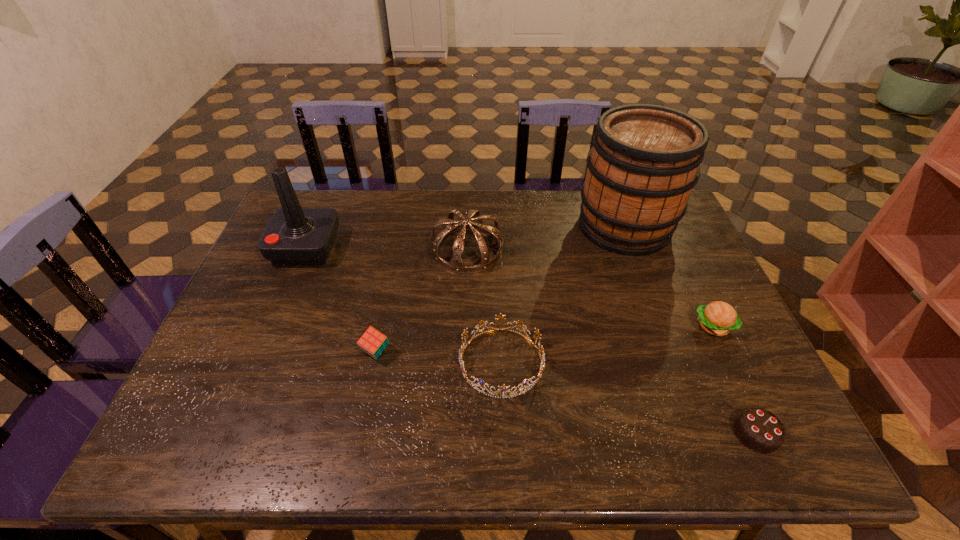
The width and height of the screenshot is (960, 540). Find the location of `free region located on the front of the sixth shortest object`. free region located on the front of the sixth shortest object is located at coordinates (268, 338).

Where is `vacant area situated 0.090m on the left of the taller tiara`? vacant area situated 0.090m on the left of the taller tiara is located at coordinates (402, 250).

Where is `vacant region located on the back of the hamburger`? The width and height of the screenshot is (960, 540). vacant region located on the back of the hamburger is located at coordinates pyautogui.click(x=667, y=228).

Find the location of a particular element. The image size is (960, 540). free region located on the left of the cube is located at coordinates (328, 352).

I want to click on free space located 0.110m on the front-facing side of the nearer tiara, so click(505, 450).

Identify the location of free spot located on the left of the chocolate cake. (655, 434).

In order to click on cider located at the far edge in this screenshot , I will do `click(644, 162)`.

You are a GUI agent. You are given a task and a screenshot of the screen. Output one action in this format:
    pyautogui.click(x=<x>, y=<y>)
    Task: Click on the joystick situated at the far edge
    The image size is (960, 540).
    Given the screenshot: What is the action you would take?
    pyautogui.click(x=294, y=236)

Where is `tiara that is at the far edge`? Image resolution: width=960 pixels, height=540 pixels. tiara that is at the far edge is located at coordinates (456, 264).

Find the location of a particular element. The image size is (960, 540). object located at the near edge is located at coordinates (759, 430).